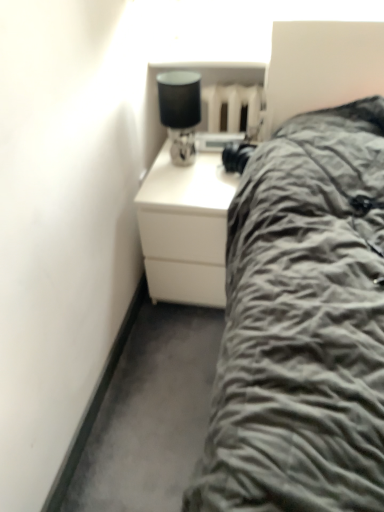
The width and height of the screenshot is (384, 512). What are the coordinates of `free point in front of matte black lampshade at upper right` in the screenshot? It's located at click(187, 183).